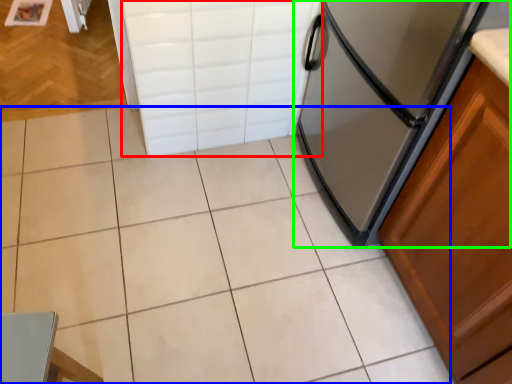
Question: Considering the real-world distances, which object is farthest from drawer (highlighted by a red box)? ceramic tile (highlighted by a blue box) or refrigerator (highlighted by a green box)?

Choices:
 (A) ceramic tile
 (B) refrigerator

Answer: (A)